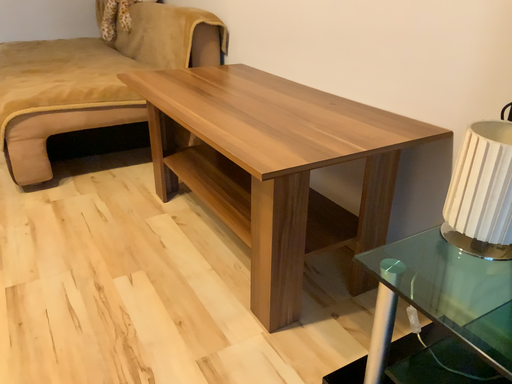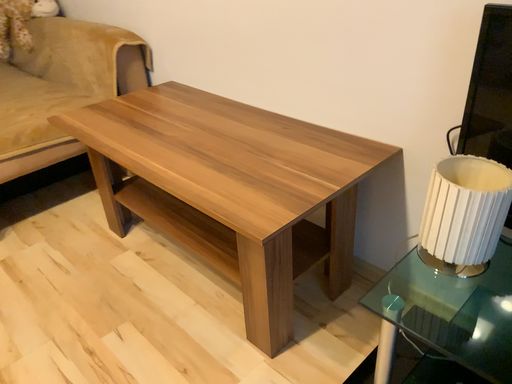
Question: How did the camera likely rotate when shooting the video?

Choices:
 (A) rotated right
 (B) rotated left

Answer: (A)